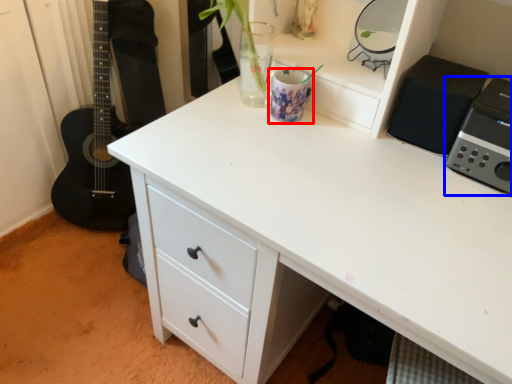
Question: Which of the following is the closest to the observer, appliance (highlighted by a red box) or appliance (highlighted by a blue box)?

Choices:
 (A) appliance
 (B) appliance

Answer: (B)